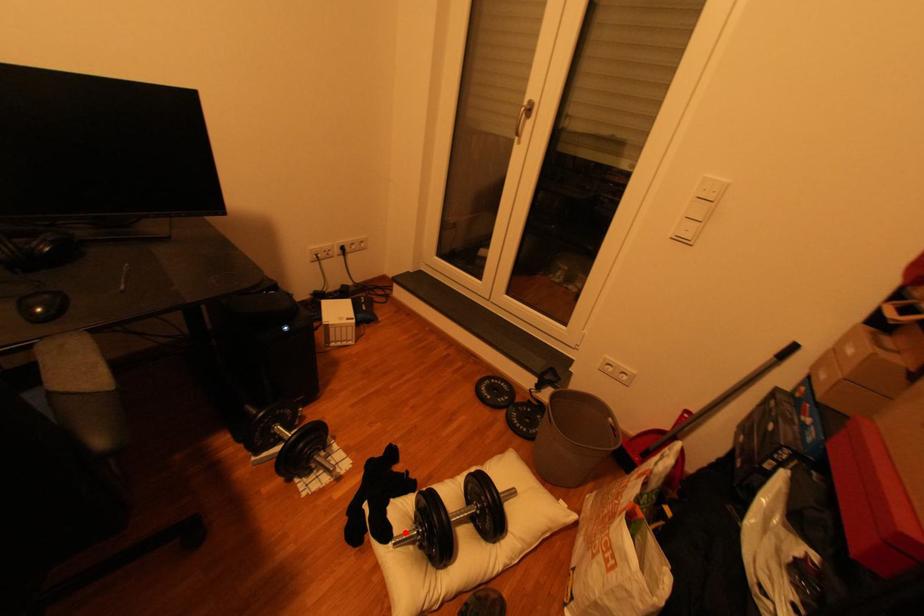
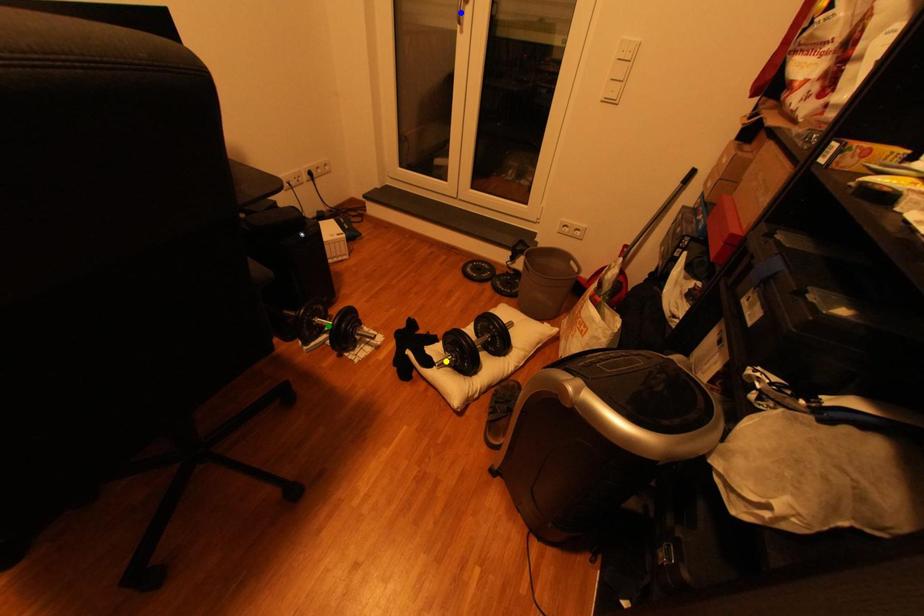
Question: I am providing you with two images of the same scene from different viewpoints. A red point is marked on the first image. You are given multiple points on the second image. Which mark in image 2 goes with the point in image 1?

Choices:
 (A) blue point
 (B) green point
 (C) yellow point

Answer: (C)